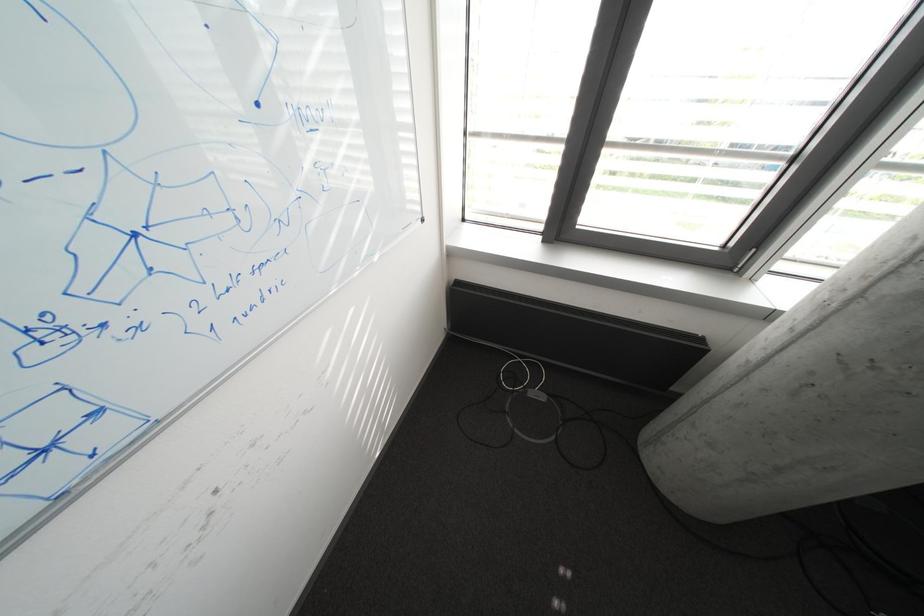
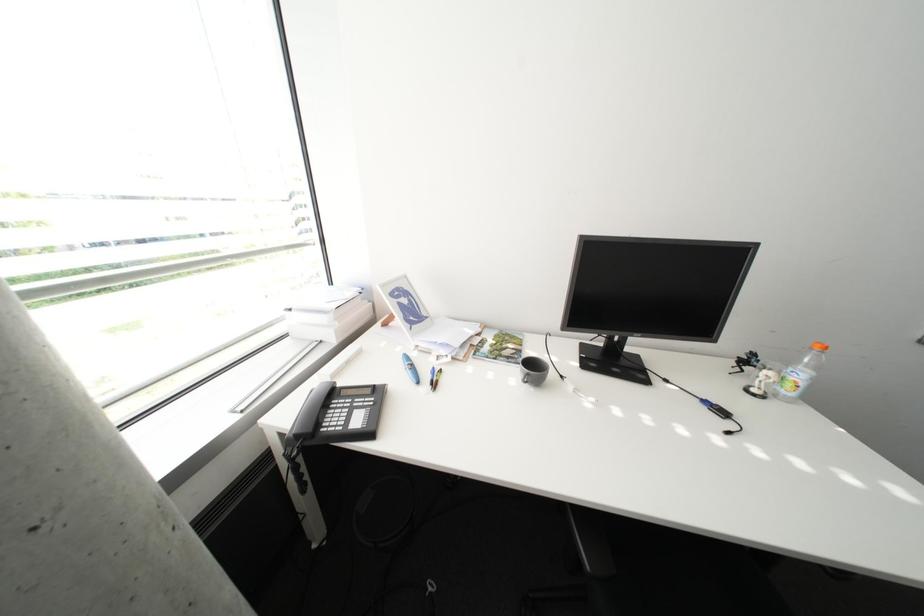
The images are taken continuously from a first-person perspective. In which direction is your viewpoint rotating?

The rotation direction of the camera is right-down.